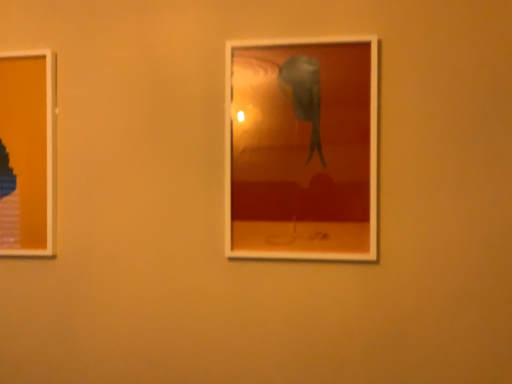
The height and width of the screenshot is (384, 512). What do you see at coordinates (302, 149) in the screenshot?
I see `matte plastic picture frame at center, which is the first picture frame in right-to-left order` at bounding box center [302, 149].

What are the coordinates of `matte plastic picture frame at center, the 2th picture frame from the left` in the screenshot? It's located at (302, 149).

I want to click on matte plastic picture frame at left, the second picture frame positioned from the right, so click(28, 153).

This screenshot has width=512, height=384. Describe the element at coordinates (28, 153) in the screenshot. I see `matte plastic picture frame at left, the first picture frame positioned from the left` at that location.

Where is `matte plastic picture frame at center, which is the second picture frame in back-to-front order`? The image size is (512, 384). matte plastic picture frame at center, which is the second picture frame in back-to-front order is located at coordinates coord(302,149).

Which is more to the left, matte plastic picture frame at center, marked as the 1th picture frame in a front-to-back arrangement, or matte plastic picture frame at left, positioned as the second picture frame in front-to-back order?

matte plastic picture frame at left, positioned as the second picture frame in front-to-back order.

Which object is closer to the camera taking this photo, matte plastic picture frame at center, which is the second picture frame in back-to-front order, or matte plastic picture frame at left, the second picture frame positioned from the right?

Positioned in front is matte plastic picture frame at center, which is the second picture frame in back-to-front order.

Which is more distant, (246, 192) or (42, 161)?

The point (42, 161) is farther.

From the image's perspective, is matte plastic picture frame at center, which is the first picture frame in right-to-left order, located beneath matte plastic picture frame at left, positioned as the 1th picture frame in back-to-front order?

No.

From a real-world perspective, relative to matte plastic picture frame at left, the second picture frame positioned from the right, is matte plastic picture frame at center, which is the first picture frame in right-to-left order, vertically above or below?

matte plastic picture frame at center, which is the first picture frame in right-to-left order, is above matte plastic picture frame at left, the second picture frame positioned from the right.

Which object is wider, matte plastic picture frame at center, which is the second picture frame in back-to-front order, or matte plastic picture frame at left, positioned as the 1th picture frame in back-to-front order?

matte plastic picture frame at center, which is the second picture frame in back-to-front order, is wider.

Between matte plastic picture frame at center, which is the second picture frame in back-to-front order, and matte plastic picture frame at left, positioned as the second picture frame in front-to-back order, which one has more height?

With more height is matte plastic picture frame at center, which is the second picture frame in back-to-front order.

Is matte plastic picture frame at center, the 2th picture frame from the left, bigger or smaller than matte plastic picture frame at left, positioned as the second picture frame in front-to-back order?

Clearly, matte plastic picture frame at center, the 2th picture frame from the left, is larger in size than matte plastic picture frame at left, positioned as the second picture frame in front-to-back order.

Consider the image. Is matte plastic picture frame at center, the 2th picture frame from the left, surrounding matte plastic picture frame at left, positioned as the 1th picture frame in back-to-front order?

Definitely not — matte plastic picture frame at left, positioned as the 1th picture frame in back-to-front order, is not inside matte plastic picture frame at center, the 2th picture frame from the left.

Are matte plastic picture frame at center, which is the first picture frame in right-to-left order, and matte plastic picture frame at left, positioned as the 1th picture frame in back-to-front order, making contact?

matte plastic picture frame at center, which is the first picture frame in right-to-left order, is not next to matte plastic picture frame at left, positioned as the 1th picture frame in back-to-front order, and they're not touching.

Is matte plastic picture frame at center, which is the first picture frame in right-to-left order, looking in the opposite direction of matte plastic picture frame at left, positioned as the 1th picture frame in back-to-front order?

No.

Can you tell me how much matte plastic picture frame at center, the 2th picture frame from the left, and matte plastic picture frame at left, positioned as the 1th picture frame in back-to-front order, differ in facing direction?

The angular difference between matte plastic picture frame at center, the 2th picture frame from the left, and matte plastic picture frame at left, positioned as the 1th picture frame in back-to-front order, is 0.00446 degrees.

Find the location of a particular element. The height and width of the screenshot is (384, 512). picture frame that appears on the right of matte plastic picture frame at left, positioned as the second picture frame in front-to-back order is located at coordinates (302, 149).

Which object is positioned more to the left, matte plastic picture frame at left, the first picture frame positioned from the left, or matte plastic picture frame at center, which is the first picture frame in right-to-left order?

From the viewer's perspective, matte plastic picture frame at left, the first picture frame positioned from the left, appears more on the left side.

Is matte plastic picture frame at left, the first picture frame positioned from the left, in front of matte plastic picture frame at center, which is the second picture frame in back-to-front order?

No, matte plastic picture frame at left, the first picture frame positioned from the left, is further to the viewer.

Is point (55, 72) closer or farther from the camera than point (330, 92)?

Point (55, 72).

From the image's perspective, which object appears higher, matte plastic picture frame at left, the second picture frame positioned from the right, or matte plastic picture frame at center, the 2th picture frame from the left?

matte plastic picture frame at center, the 2th picture frame from the left, is shown above in the image.

From a real-world perspective, is matte plastic picture frame at left, positioned as the second picture frame in front-to-back order, above or below matte plastic picture frame at center, marked as the 1th picture frame in a front-to-back arrangement?

In terms of real-world spatial position, matte plastic picture frame at left, positioned as the second picture frame in front-to-back order, is below matte plastic picture frame at center, marked as the 1th picture frame in a front-to-back arrangement.

Is matte plastic picture frame at left, positioned as the 1th picture frame in back-to-front order, wider or thinner than matte plastic picture frame at center, which is the second picture frame in back-to-front order?

In the image, matte plastic picture frame at left, positioned as the 1th picture frame in back-to-front order, appears to be more narrow than matte plastic picture frame at center, which is the second picture frame in back-to-front order.

Between matte plastic picture frame at left, the second picture frame positioned from the right, and matte plastic picture frame at center, which is the first picture frame in right-to-left order, which one has more height?

matte plastic picture frame at center, which is the first picture frame in right-to-left order, is taller.

Considering the relative sizes of matte plastic picture frame at left, the second picture frame positioned from the right, and matte plastic picture frame at center, which is the first picture frame in right-to-left order, in the image provided, is matte plastic picture frame at left, the second picture frame positioned from the right, smaller than matte plastic picture frame at center, which is the first picture frame in right-to-left order,?

Yes, matte plastic picture frame at left, the second picture frame positioned from the right, is smaller than matte plastic picture frame at center, which is the first picture frame in right-to-left order.

Looking at this image, is matte plastic picture frame at left, the second picture frame positioned from the right, outside of matte plastic picture frame at center, marked as the 1th picture frame in a front-to-back arrangement?

matte plastic picture frame at left, the second picture frame positioned from the right, lies outside matte plastic picture frame at center, marked as the 1th picture frame in a front-to-back arrangement,'s area.

Is matte plastic picture frame at left, the first picture frame positioned from the left, far away from matte plastic picture frame at center, which is the second picture frame in back-to-front order?

No, there isn't a large distance between matte plastic picture frame at left, the first picture frame positioned from the left, and matte plastic picture frame at center, which is the second picture frame in back-to-front order.

Is matte plastic picture frame at center, which is the first picture frame in right-to-left order, at the back of matte plastic picture frame at left, positioned as the second picture frame in front-to-back order?

No, matte plastic picture frame at left, positioned as the second picture frame in front-to-back order, is not facing away from matte plastic picture frame at center, which is the first picture frame in right-to-left order.

Can you tell me how much matte plastic picture frame at left, positioned as the second picture frame in front-to-back order, and matte plastic picture frame at center, which is the first picture frame in right-to-left order, differ in facing direction?

0.00446 degrees separate the facing orientations of matte plastic picture frame at left, positioned as the second picture frame in front-to-back order, and matte plastic picture frame at center, which is the first picture frame in right-to-left order.

Identify the location of picture frame below the matte plastic picture frame at center, which is the second picture frame in back-to-front order (from the image's perspective). The image size is (512, 384). (28, 153).

Locate an element on the screen. The width and height of the screenshot is (512, 384). picture frame above the matte plastic picture frame at left, positioned as the 1th picture frame in back-to-front order (from a real-world perspective) is located at coordinates (302, 149).

The width and height of the screenshot is (512, 384). Find the location of `picture frame on the left of matte plastic picture frame at center, marked as the 1th picture frame in a front-to-back arrangement`. picture frame on the left of matte plastic picture frame at center, marked as the 1th picture frame in a front-to-back arrangement is located at coordinates (28, 153).